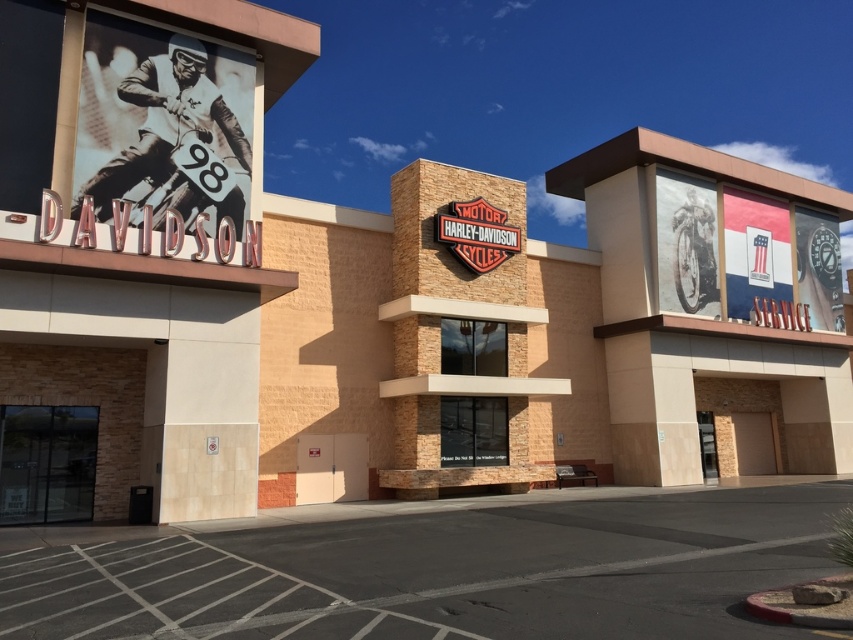
You are standing at the entrance of the Harley dealership and want to enter through the transparent glass door at lower left. However, you notice a gray asphalt at lower center nearby. Which object is taller between the two?

The transparent glass door at lower left is taller than the gray asphalt at lower center according to the description.